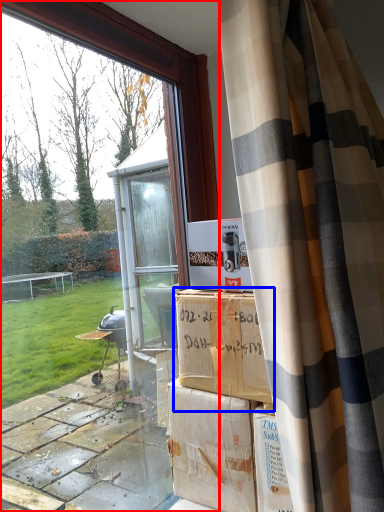
Question: Which object is closer to the camera taking this photo, window (highlighted by a red box) or cardboard box (highlighted by a blue box)?

Choices:
 (A) window
 (B) cardboard box

Answer: (A)